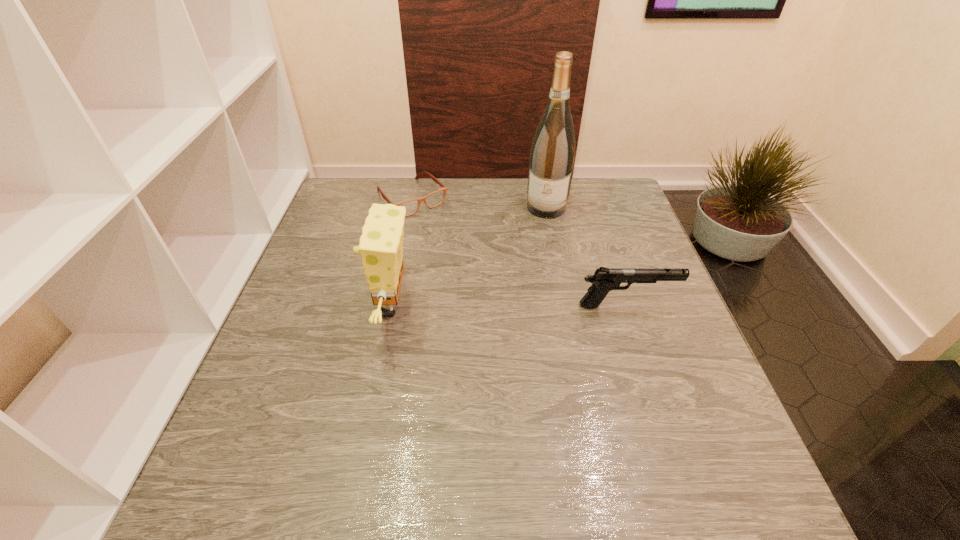
Identify the location of free space at the left edge of the desktop. (361, 227).

This screenshot has width=960, height=540. What are the coordinates of `vacant space at the right edge of the desktop` in the screenshot? It's located at (632, 232).

I want to click on vacant space at the far left corner of the desktop, so point(349,196).

In the image, there is a desktop. Where is `vacant region at the near left corner`? The image size is (960, 540). vacant region at the near left corner is located at coordinates (295, 411).

You are a GUI agent. You are given a task and a screenshot of the screen. Output one action in this format:
    pyautogui.click(x=<x>, y=<y>)
    Task: Click on the free spot at the far right corner of the desktop
    
    Given the screenshot: What is the action you would take?
    pyautogui.click(x=596, y=194)

At what (x,y) coordinates should I click in order to perform the action: click on blank region between the wine bottle and the shortest object. Please return your answer as a coordinate pair (x, y). The height and width of the screenshot is (540, 960). Looking at the image, I should click on (479, 203).

What are the coordinates of `free space between the shortest object and the second shortest object` in the screenshot? It's located at (519, 252).

Locate an element on the screen. The image size is (960, 540). vacant space in between the second shortest object and the sponge is located at coordinates (508, 306).

The height and width of the screenshot is (540, 960). Identify the location of vacant region between the shortest object and the gun. (519, 252).

Identify the location of free space between the spectacles and the gun. This screenshot has height=540, width=960. (519, 252).